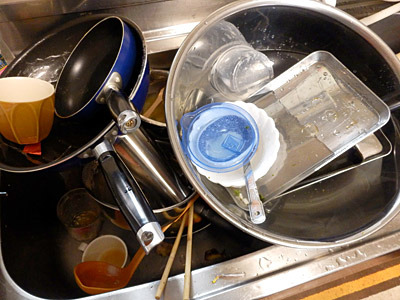
I want to click on white coffee cup, so click(x=112, y=238).